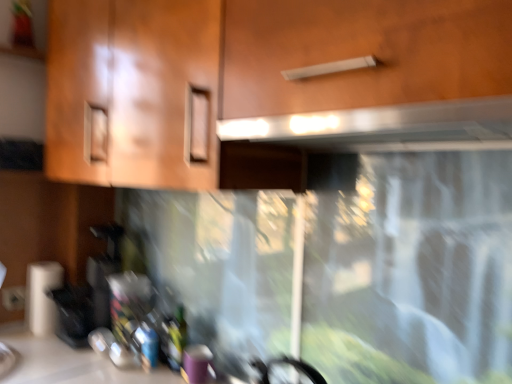
Question: Considering the positions of white matte paper towel at lower left and satin silver exhaust hood at upper center in the image, is white matte paper towel at lower left bigger or smaller than satin silver exhaust hood at upper center?

Choices:
 (A) small
 (B) big

Answer: (A)

Question: In the image, is white matte paper towel at lower left on the left side or the right side of satin silver exhaust hood at upper center?

Choices:
 (A) right
 (B) left

Answer: (B)

Question: Estimate the real-world distances between objects in this image. Which object is closer to the green glass bottle at lower center?

Choices:
 (A) white matte paper towel at lower left
 (B) matte wood cabinet at upper center
 (C) white plastic electric outlet at lower left
 (D) satin silver exhaust hood at upper center

Answer: (A)

Question: Considering the real-world distances, which object is closest to the green glass bottle at lower center?

Choices:
 (A) satin silver exhaust hood at upper center
 (B) white plastic electric outlet at lower left
 (C) matte wood cabinet at upper center
 (D) white matte paper towel at lower left

Answer: (D)